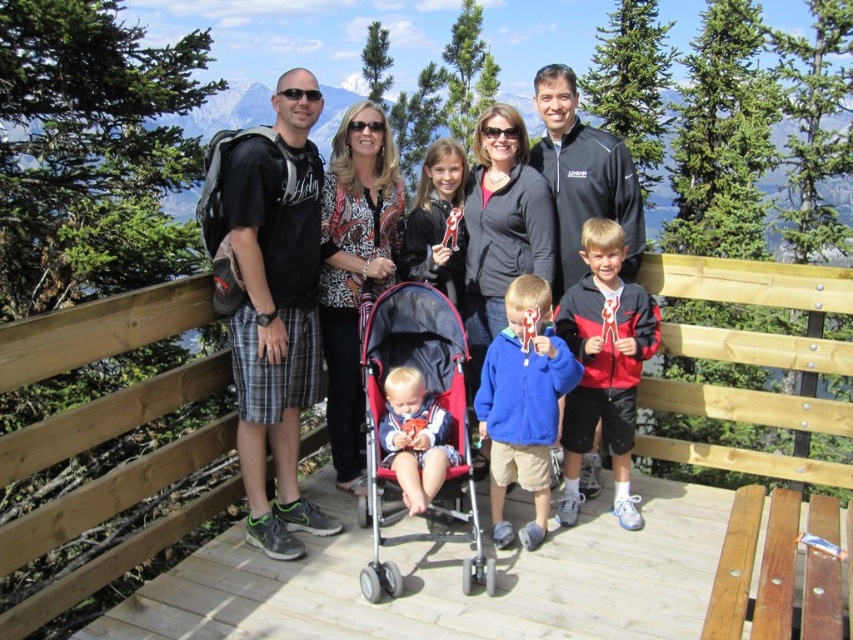
Question: Can you confirm if wooden at center is bigger than blue fleece jacket at center?

Choices:
 (A) no
 (B) yes

Answer: (B)

Question: Considering the relative positions of wooden at center and wooden bench at lower center in the image provided, where is wooden at center located with respect to wooden bench at lower center?

Choices:
 (A) right
 (B) left

Answer: (B)

Question: Which point appears closest to the camera in this image?

Choices:
 (A) (448, 368)
 (B) (554, 355)
 (C) (585, 317)

Answer: (B)

Question: Which of the following is the closest to the observer?

Choices:
 (A) blue fleece jacket at center
 (B) red fabric stroller at center

Answer: (B)

Question: Can you confirm if wooden at center is positioned to the left of wooden bench at lower center?

Choices:
 (A) yes
 (B) no

Answer: (A)

Question: Among these points, which one is farthest from the camera?

Choices:
 (A) (410, 440)
 (B) (544, 499)

Answer: (B)